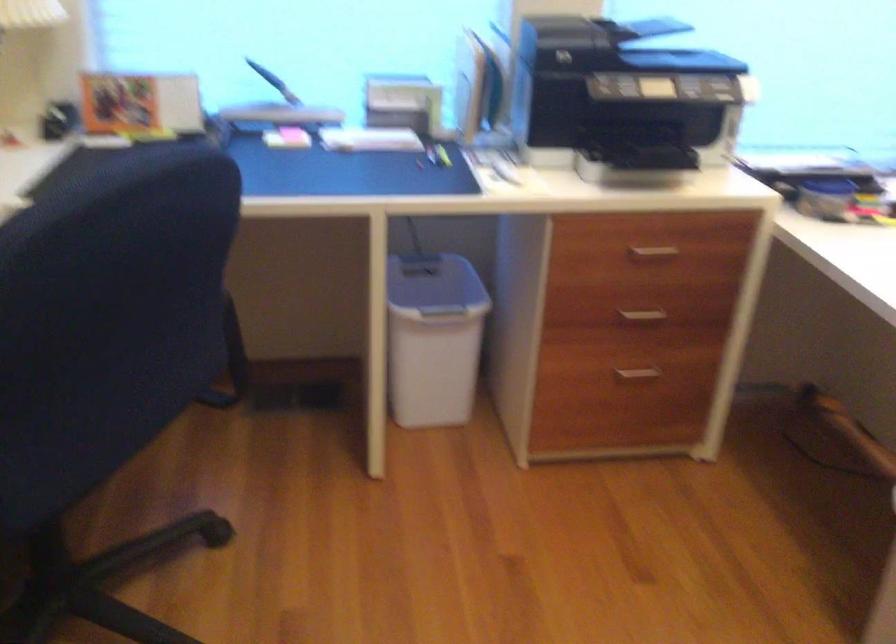
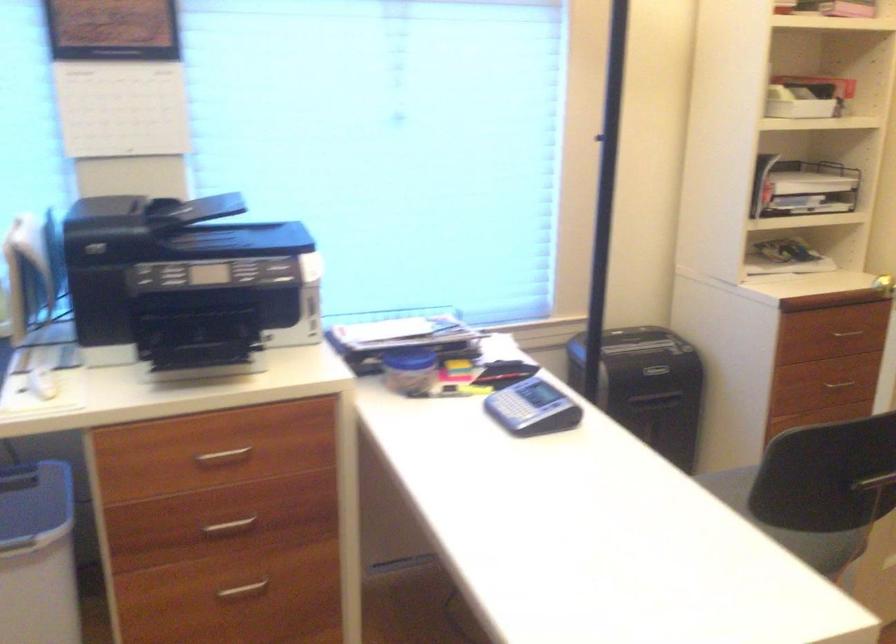
Question: How did the camera likely rotate?

Choices:
 (A) Left
 (B) Right
 (C) Up
 (D) Down

Answer: (B)